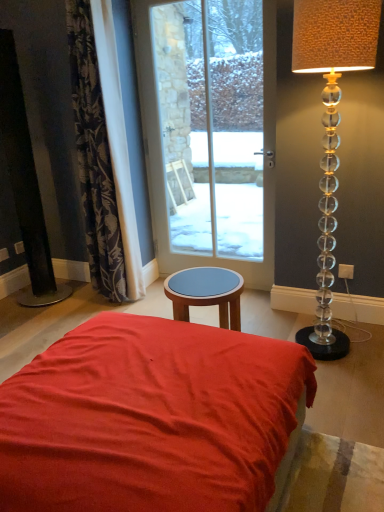
I want to click on empty space that is to the right of translucent glass lamp at right, so click(x=366, y=343).